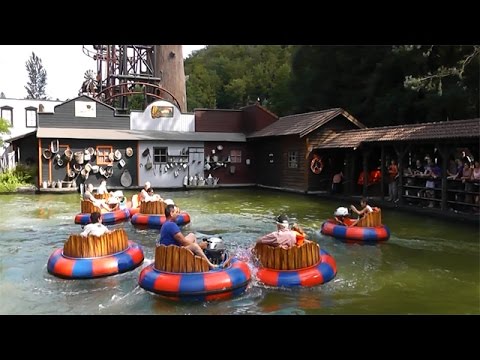
The height and width of the screenshot is (360, 480). I want to click on easily visible windows, so click(x=239, y=154), click(x=298, y=161), click(x=160, y=151), click(x=109, y=150), click(x=30, y=113), click(x=7, y=117).